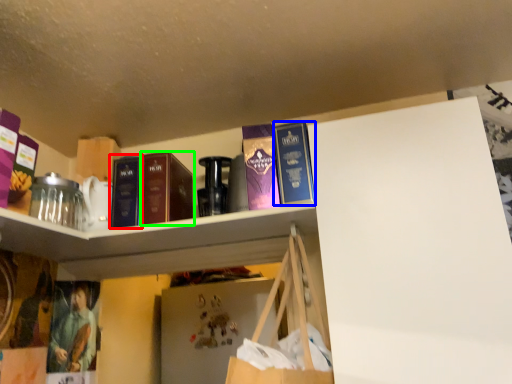
Question: Which object is positioned closest to book (highlighted by a red box)? Select from book (highlighted by a blue box) and book (highlighted by a green box).

Choices:
 (A) book
 (B) book

Answer: (B)